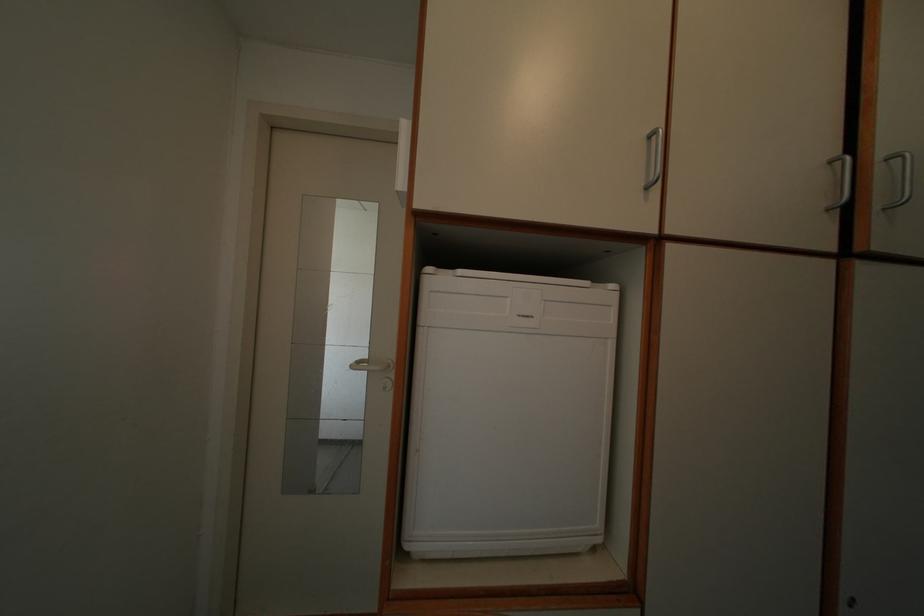
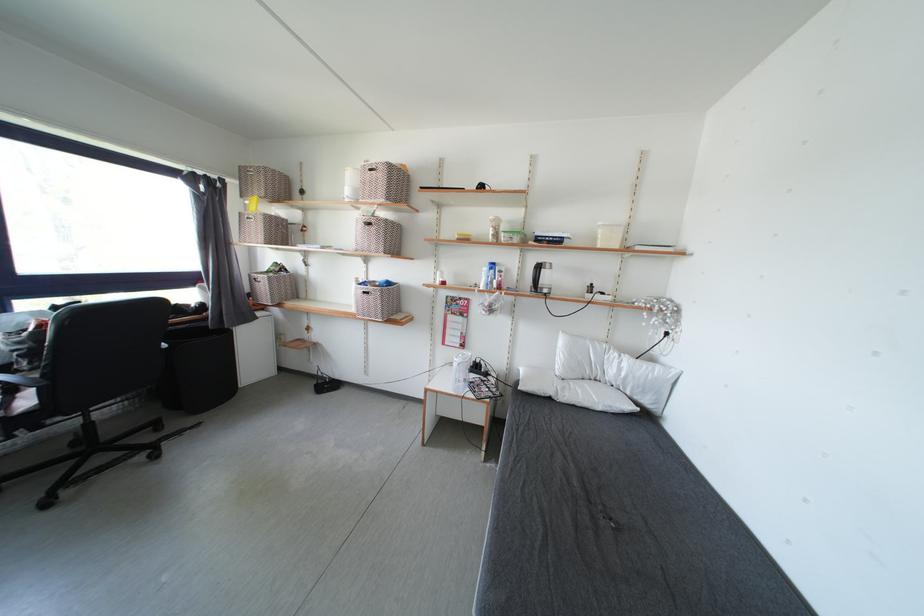
Question: What movement of the cameraman would produce the second image?

Choices:
 (A) Left
 (B) Right
 (C) Forward
 (D) Backward

Answer: (A)